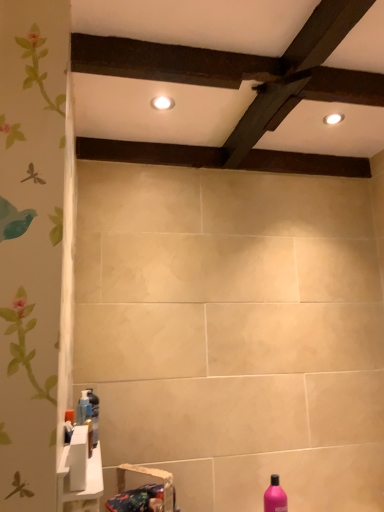
Question: Should I look upward or downward to see white glossy sink at lower left, arranged as the 2th sink when ordered from the bottom?

Choices:
 (A) up
 (B) down

Answer: (B)

Question: Can you see blue fabric sink at lower left, the second sink viewed from the top, touching pink glossy bottle at lower right, which appears as the 1th bottle when viewed from the right?

Choices:
 (A) no
 (B) yes

Answer: (A)

Question: Is blue fabric sink at lower left, which appears as the 1th sink when ordered from the bottom, positioned with its back to pink glossy bottle at lower right, the 2th bottle when ordered from left to right?

Choices:
 (A) no
 (B) yes

Answer: (A)

Question: From a real-world perspective, is blue fabric sink at lower left, the second sink viewed from the top, on top of pink glossy bottle at lower right, which is the 2th bottle from front to back?

Choices:
 (A) yes
 (B) no

Answer: (A)

Question: Are blue fabric sink at lower left, which appears as the 1th sink when ordered from the bottom, and pink glossy bottle at lower right, acting as the first bottle starting from the bottom, located far from each other?

Choices:
 (A) no
 (B) yes

Answer: (A)

Question: Is blue fabric sink at lower left, the second sink viewed from the top, smaller than pink glossy bottle at lower right, which ranks as the 2th bottle in top-to-bottom order?

Choices:
 (A) yes
 (B) no

Answer: (B)

Question: Is blue fabric sink at lower left, which appears as the 1th sink when ordered from the bottom, bigger than pink glossy bottle at lower right, which ranks as the 2th bottle in top-to-bottom order?

Choices:
 (A) no
 (B) yes

Answer: (B)

Question: Can you confirm if white glossy light fixture at upper right, the 2th lighting positioned from the left, is wider than pink glossy bottle at lower right, which ranks as the 2th bottle in top-to-bottom order?

Choices:
 (A) no
 (B) yes

Answer: (A)

Question: Is white glossy light fixture at upper right, the first lighting positioned from the right, turned away from pink glossy bottle at lower right, acting as the first bottle starting from the bottom?

Choices:
 (A) no
 (B) yes

Answer: (A)

Question: Considering the relative sizes of white glossy light fixture at upper right, the first lighting positioned from the right, and pink glossy bottle at lower right, which ranks as the 2th bottle in top-to-bottom order, in the image provided, is white glossy light fixture at upper right, the first lighting positioned from the right, taller than pink glossy bottle at lower right, which ranks as the 2th bottle in top-to-bottom order,?

Choices:
 (A) no
 (B) yes

Answer: (A)

Question: Are white glossy light fixture at upper right, the first lighting positioned from the right, and pink glossy bottle at lower right, the 2th bottle when ordered from left to right, beside each other?

Choices:
 (A) no
 (B) yes

Answer: (A)

Question: Is white glossy light fixture at upper right, acting as the 1th lighting starting from the back, surrounding pink glossy bottle at lower right, the 2th bottle when ordered from left to right?

Choices:
 (A) no
 (B) yes

Answer: (A)

Question: From the image's perspective, is white glossy light fixture at upper right, the 2th lighting positioned from the left, beneath pink glossy bottle at lower right, acting as the first bottle starting from the bottom?

Choices:
 (A) no
 (B) yes

Answer: (A)

Question: From the image's perspective, does blue fabric sink at lower left, the second sink viewed from the top, appear lower than translucent plastic bottle at lower left, which is the 2th bottle in back-to-front order?

Choices:
 (A) yes
 (B) no

Answer: (A)